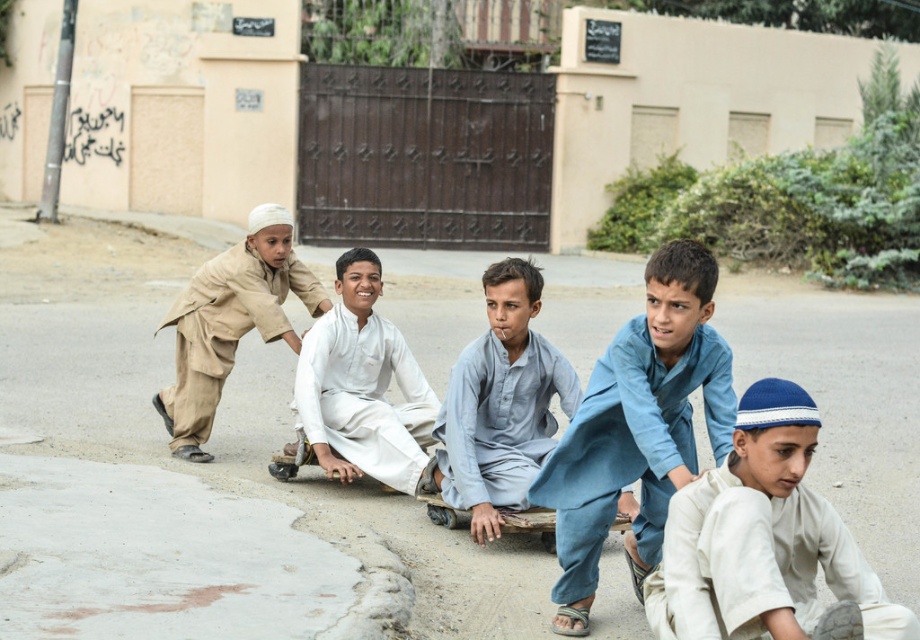
Question: Does light gray cotton shirt at center have a larger size compared to white cotton shirt at center?

Choices:
 (A) no
 (B) yes

Answer: (A)

Question: Estimate the real-world distances between objects in this image. Which object is farther from the gray concrete pavement at center?

Choices:
 (A) white cotton shirt at lower right
 (B) white cotton shirt at center
 (C) blue cotton shirt at center

Answer: (C)

Question: Which point appears closest to the camera in this image?

Choices:
 (A) (243, 280)
 (B) (499, 291)
 (C) (555, 586)
 (D) (384, 435)

Answer: (C)

Question: Is white cotton shirt at center above light brown cotton outfit at left?

Choices:
 (A) no
 (B) yes

Answer: (A)

Question: Does blue cotton shirt at center have a larger size compared to light gray cotton shirt at center?

Choices:
 (A) yes
 (B) no

Answer: (A)

Question: Which object is the farthest from the white cotton shirt at lower right?

Choices:
 (A) blue cotton shirt at center
 (B) gray concrete pavement at center

Answer: (B)